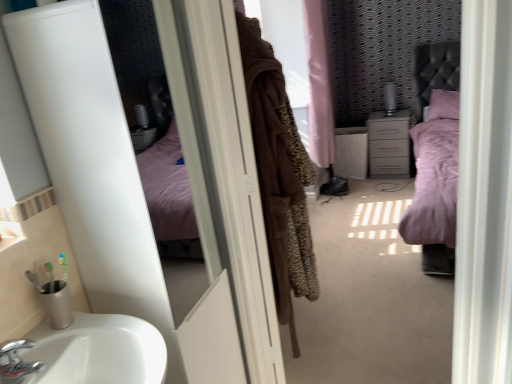
At what (x,y) coordinates should I click in order to perform the action: click on blank space above matte gray chest of drawers at center (from a real-world perspective). Please return your answer as a coordinate pair (x, y). The image size is (512, 384). Looking at the image, I should click on (385, 114).